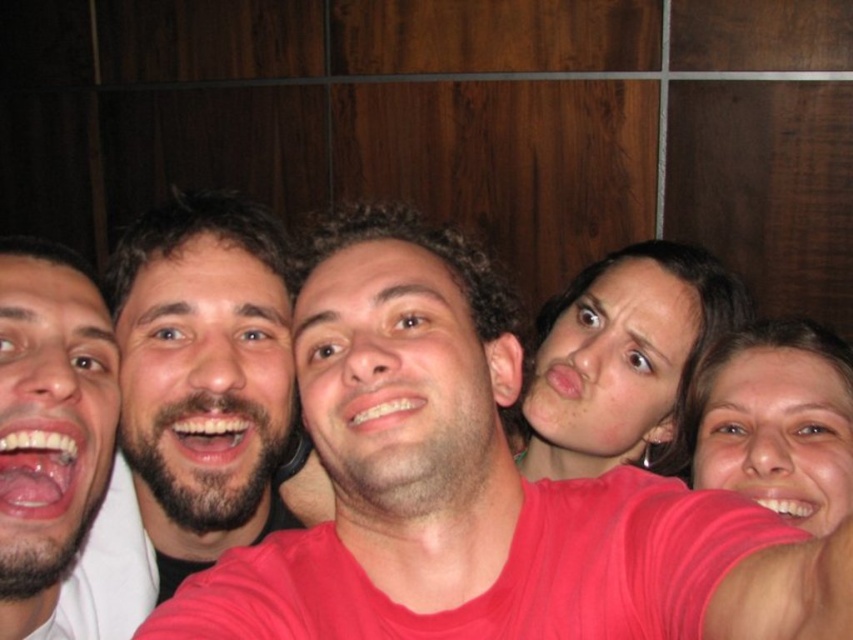
You are standing in front of a group photo where the pink fabric shirt at center is the focal point. If you want to view the entire group clearly, should you step back or move closer?

→ The pink fabric shirt at center and viewer are 15.46 inches apart from each other. To view the entire group clearly, you should step back to ensure all individuals are in frame.

You are standing in front of the group photo and want to locate the pink fabric shirt at center. Where exactly is it positioned in the image?

The pink fabric shirt at center is located at point coordinates of (480, 486).

From the picture: You are taking a photo of two people standing in front of a wooden panel background. You notice a pink fabric shirt at center and a smooth skin face at center. Which object is positioned closer to the camera?

The pink fabric shirt at center is closer to the viewer than the smooth skin face at center, so the pink fabric shirt at center is positioned closer to the camera.